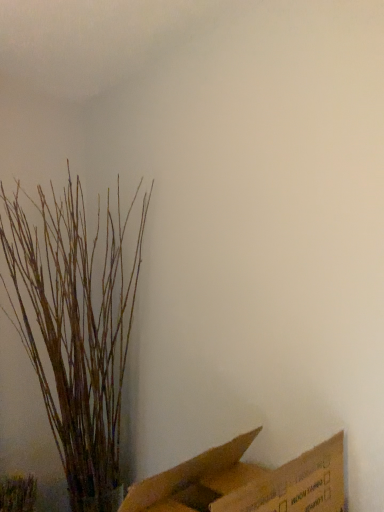
This screenshot has width=384, height=512. What do you see at coordinates (75, 330) in the screenshot?
I see `brown matte plant at left` at bounding box center [75, 330].

The image size is (384, 512). Identify the location of brown matte plant at left. (75, 330).

Where is `brown matte plant at left`? This screenshot has width=384, height=512. brown matte plant at left is located at coordinates (75, 330).